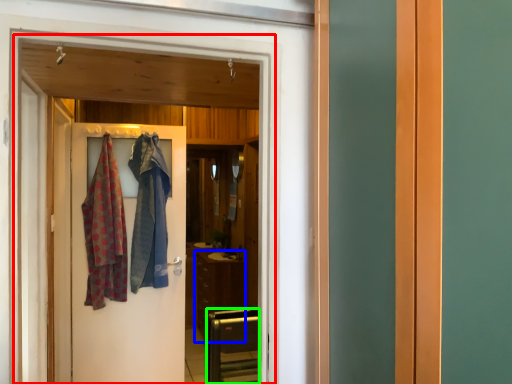
Question: Based on their relative distances, which object is nearer to elevator (highlighted by a red box)? Choose from cabinetry (highlighted by a blue box) and furniture (highlighted by a green box).

Choices:
 (A) cabinetry
 (B) furniture

Answer: (B)